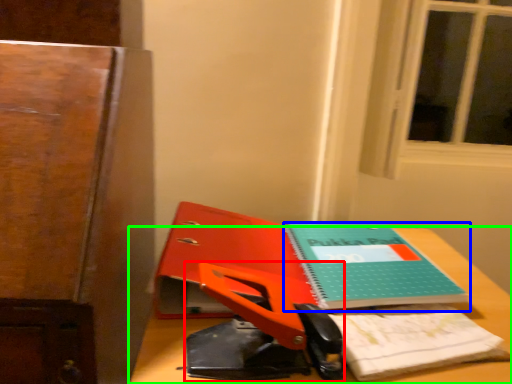
Question: Which is nearer to the scissors (highlighted by a red box)? book (highlighted by a blue box) or desk (highlighted by a green box).

Choices:
 (A) book
 (B) desk

Answer: (B)